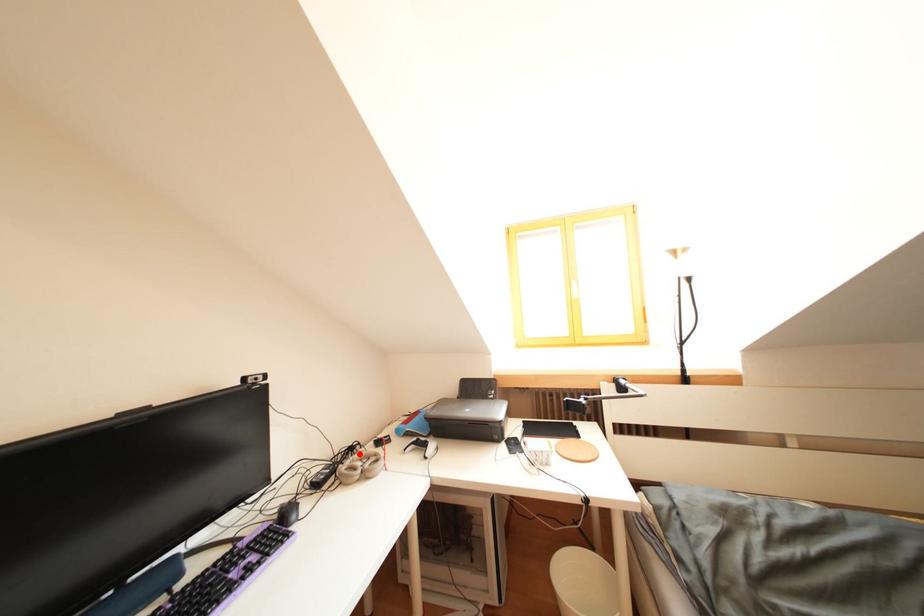
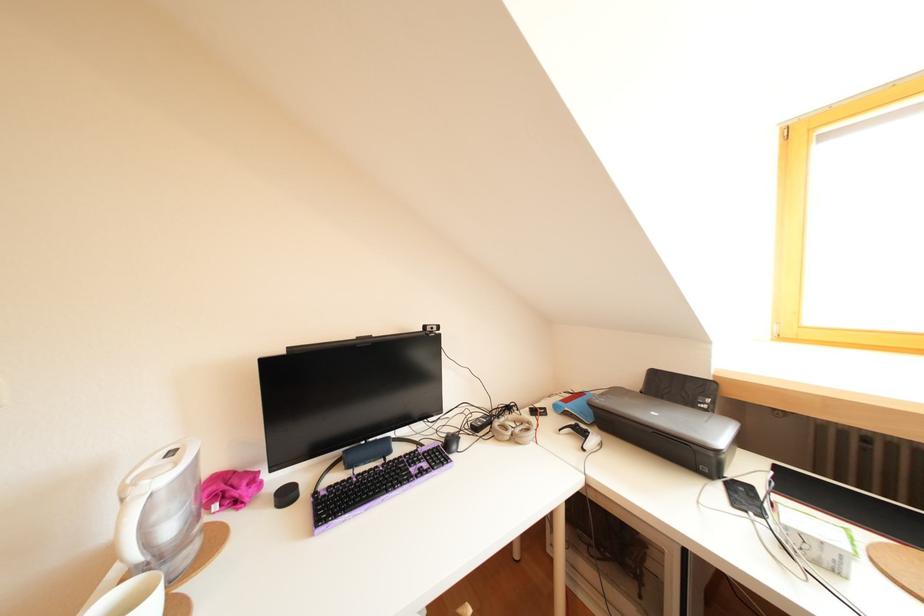
Question: I am providing you with two images of the same scene from different viewpoints. A red point is marked on the first image. At the location where the point appears in image 1, is it still visible in image 2?

Choices:
 (A) Yes
 (B) No

Answer: (A)